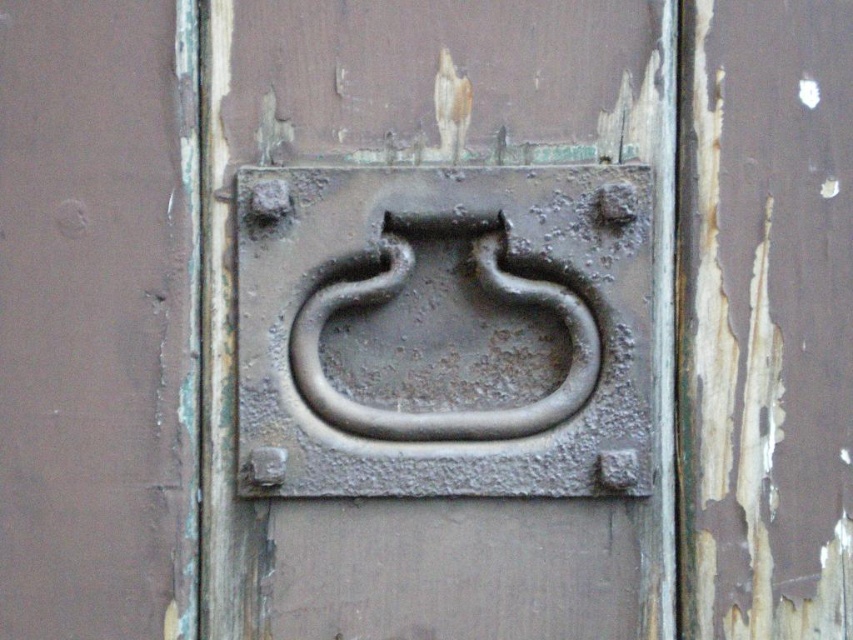
Question: Among these points, which one is farthest from the camera?

Choices:
 (A) (440, 221)
 (B) (311, 368)

Answer: (B)

Question: Is the position of rusty metal handle at center more distant than that of rusty metal door handle at center?

Choices:
 (A) no
 (B) yes

Answer: (A)

Question: Can you confirm if rusty metal handle at center is positioned to the right of rusty metal door handle at center?

Choices:
 (A) no
 (B) yes

Answer: (A)

Question: Considering the relative positions of rusty metal handle at center and rusty metal door handle at center in the image provided, where is rusty metal handle at center located with respect to rusty metal door handle at center?

Choices:
 (A) left
 (B) right

Answer: (A)